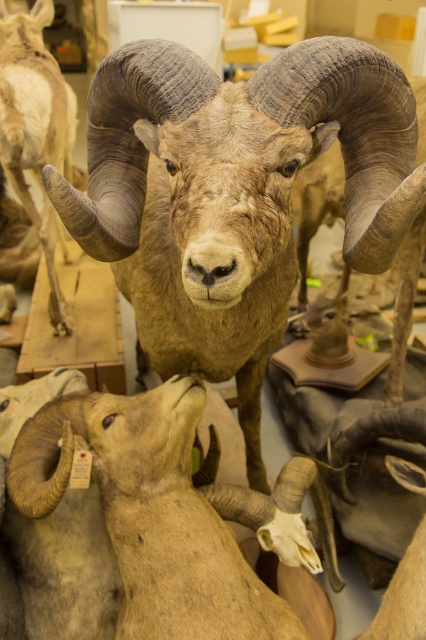
You are a taxidermist assessing the specimens. Which of the two animals, the brown textured ram at center or the light brown woolen sheep at lower center, has a more slender body structure?

The brown textured ram at center is thinner than the light brown woolen sheep at lower center, so it has a more slender body structure.

You are a museum curator arranging an exhibition. You have two specimens in front of you, the brown textured ram at center and the light brown woolen sheep at lower center. Which specimen should you place on the higher shelf to maintain proper height alignment?

The brown textured ram at center should be placed on the higher shelf since it has a greater height compared to the light brown woolen sheep at lower center.

You are standing in front of a display of taxidermied animals and notice a point marked at coordinates [233,195]. Which animal in the display does this point belong to?

The point at coordinates [233,195] is on the brown textured ram at center.